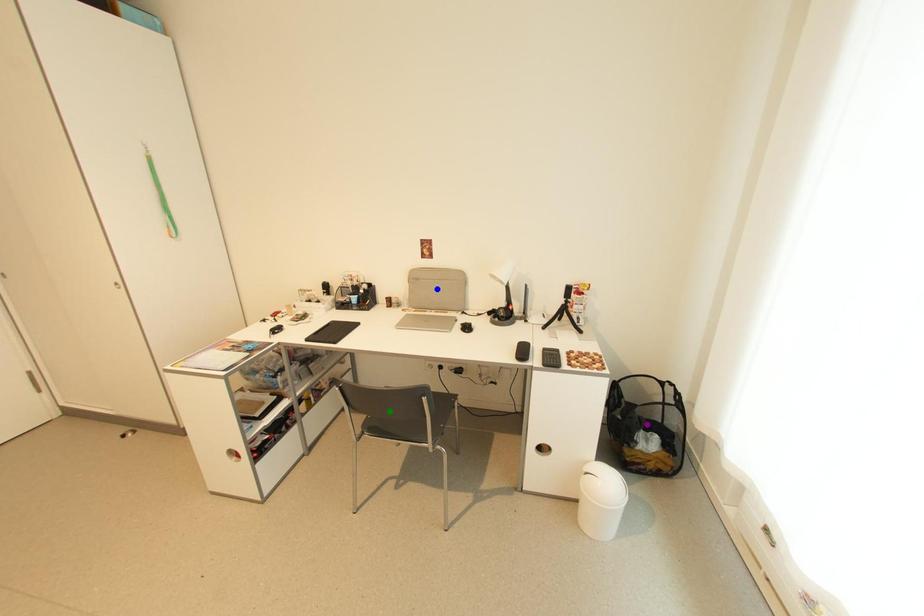
Order these from nearest to farthest:
1. green point
2. purple point
3. blue point

blue point < purple point < green point